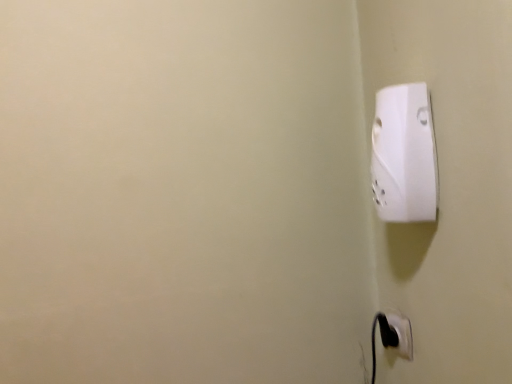
Question: Based on their sizes in the image, would you say white plastic power plug at upper right, arranged as the second power plugs and sockets when viewed from the back, is bigger or smaller than black plastic power plug at lower right, the second power plugs and sockets when ordered from top to bottom?

Choices:
 (A) big
 (B) small

Answer: (A)

Question: Is point (395, 208) closer or farther from the camera than point (408, 339)?

Choices:
 (A) farther
 (B) closer

Answer: (B)

Question: Considering the positions of white plastic power plug at upper right, the first power plugs and sockets when ordered from front to back, and black plastic power plug at lower right, the 1th power plugs and sockets in the bottom-to-top sequence, in the image, is white plastic power plug at upper right, the first power plugs and sockets when ordered from front to back, wider or thinner than black plastic power plug at lower right, the 1th power plugs and sockets in the bottom-to-top sequence,?

Choices:
 (A) wide
 (B) thin

Answer: (A)

Question: From their relative heights in the image, would you say black plastic power plug at lower right, marked as the second power plugs and sockets in a front-to-back arrangement, is taller or shorter than white plastic power plug at upper right, the first power plugs and sockets positioned from the top?

Choices:
 (A) tall
 (B) short

Answer: (B)

Question: From a real-world perspective, is black plastic power plug at lower right, the second power plugs and sockets when ordered from top to bottom, positioned above or below white plastic power plug at upper right, the first power plugs and sockets when ordered from front to back?

Choices:
 (A) above
 (B) below

Answer: (B)

Question: Considering the positions of point (382, 326) and point (394, 135), is point (382, 326) closer or farther from the camera than point (394, 135)?

Choices:
 (A) closer
 (B) farther

Answer: (B)

Question: Is black plastic power plug at lower right, the first power plugs and sockets in the back-to-front sequence, in front of or behind white plastic power plug at upper right, the first power plugs and sockets when ordered from front to back, in the image?

Choices:
 (A) front
 (B) behind

Answer: (B)